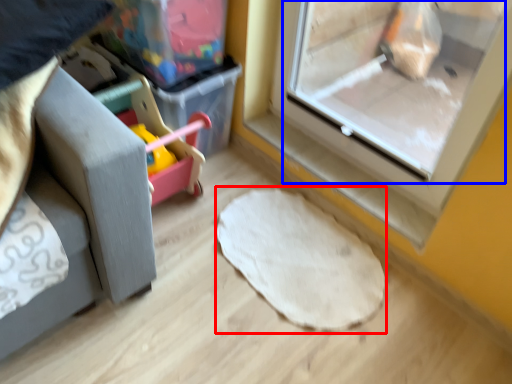
Question: Which point is closer to the camera, mat (highlighted by a red box) or screen door (highlighted by a blue box)?

Choices:
 (A) mat
 (B) screen door

Answer: (B)